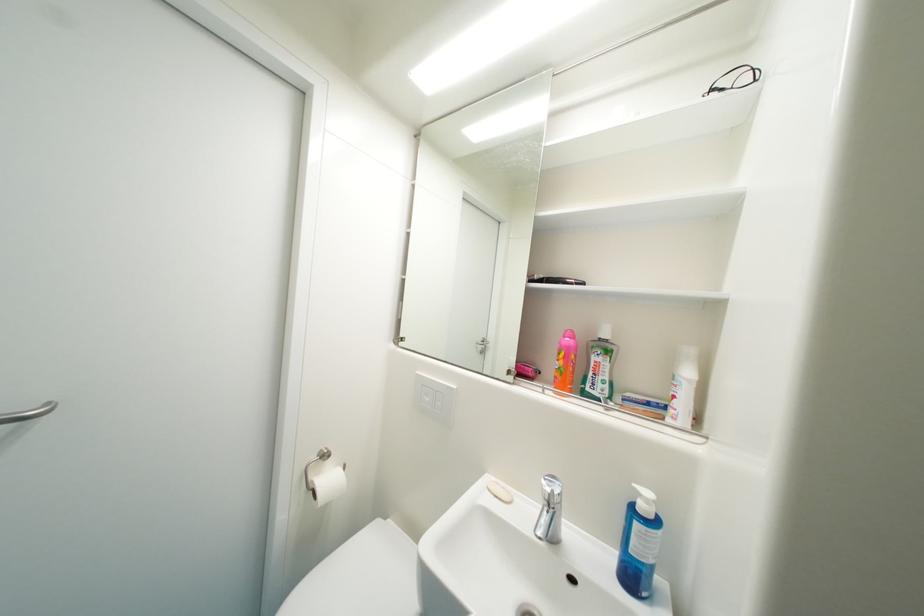
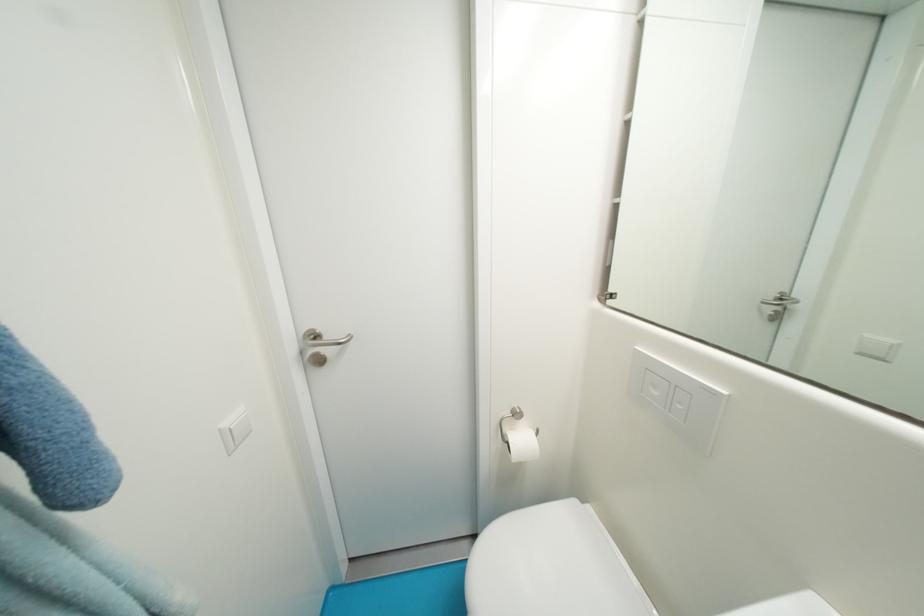
Question: The images are taken continuously from a first-person perspective. In which direction is your viewpoint rotating?

Choices:
 (A) Left
 (B) Right
 (C) Up
 (D) Down

Answer: (A)